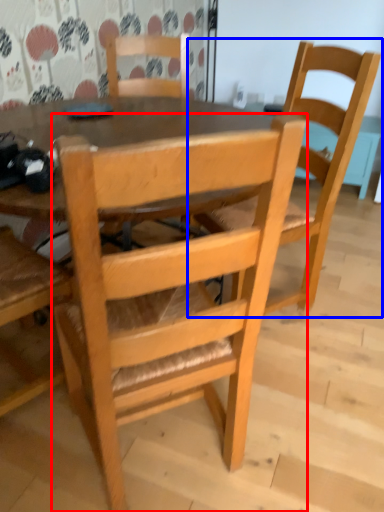
Question: Which object appears closest to the camera in this image, chair (highlighted by a red box) or chair (highlighted by a blue box)?

Choices:
 (A) chair
 (B) chair

Answer: (A)